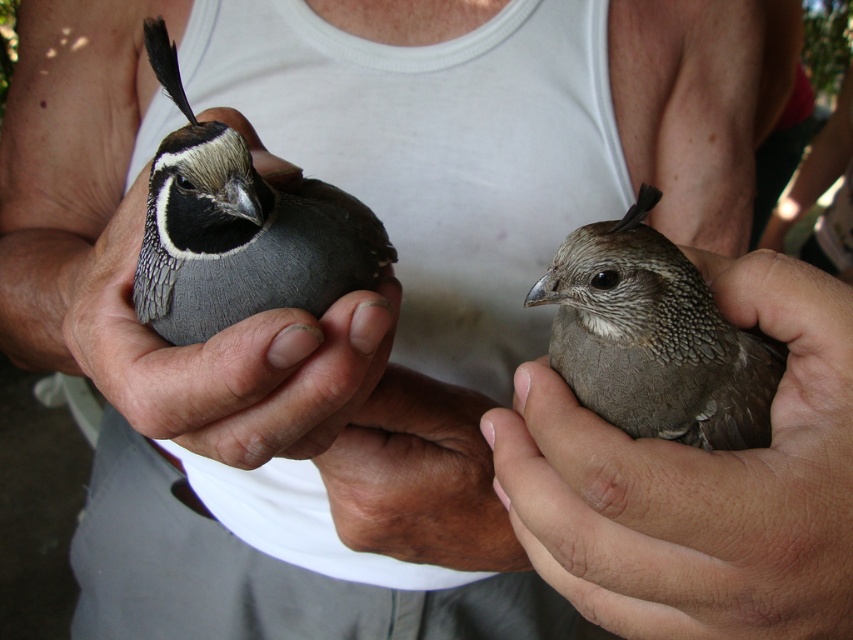
You are a photographer trying to capture a closeup of the birds held by the person. You are currently positioned at point point (115, 289). The camera you are using has a minimum focusing distance of 20 inches. Will you be able to take a clear photo of the birds from your current position?

The distance between point (115, 289) and the camera is 19.78 inches, which is less than the minimum focusing distance of 20 inches. Therefore, you will not be able to take a clear photo of the birds from your current position.

You are a researcher observing birds in a wildlife sanctuary. You need to locate the matte gray bird at left in the image. What are the coordinates where you can find it?

The matte gray bird at left is located at coordinates point (224, 360).